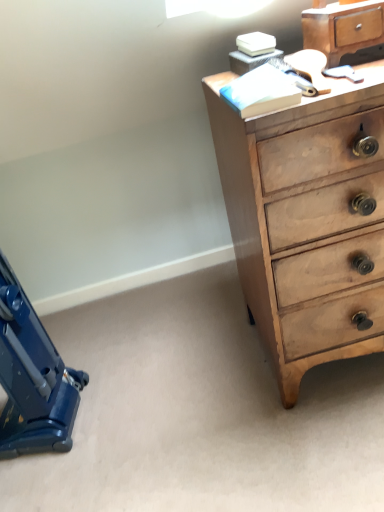
Question: From the image's perspective, is light brown wood chest of drawers at upper right positioned above or below blue plastic vacuum cleaner at lower left?

Choices:
 (A) below
 (B) above

Answer: (B)

Question: Relative to blue plastic vacuum cleaner at lower left, is light brown wood chest of drawers at upper right in front or behind?

Choices:
 (A) behind
 (B) front

Answer: (B)

Question: Considering the real-world distances, which object is closest to the light brown wood chest of drawers at upper right?

Choices:
 (A) blue plastic vacuum cleaner at lower left
 (B) wooden chest of drawers at upper right

Answer: (B)

Question: Which is farther from the blue plastic vacuum cleaner at lower left?

Choices:
 (A) wooden chest of drawers at upper right
 (B) light brown wood chest of drawers at upper right

Answer: (A)